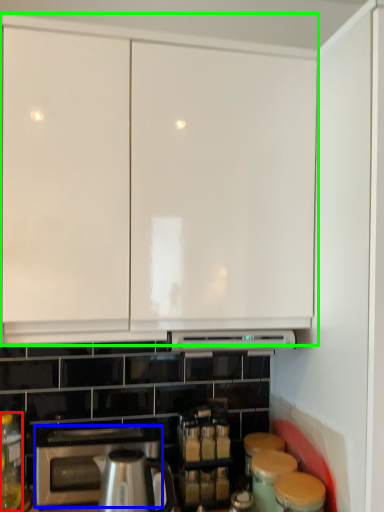
Question: Which object is the closest to the bottle (highlighted by a red box)? Choose among these: home appliance (highlighted by a blue box) or cabinetry (highlighted by a green box).

Choices:
 (A) home appliance
 (B) cabinetry

Answer: (A)